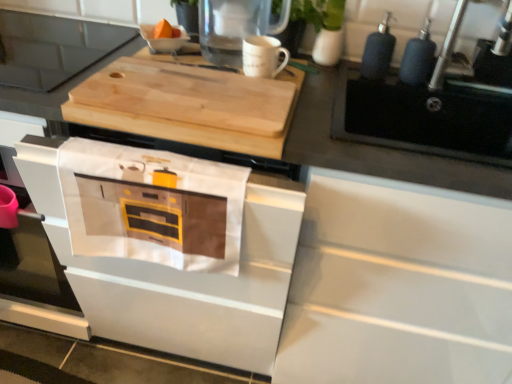
Question: Is clear glass pitcher at upper center placed right next to metallic silver faucet at upper right?

Choices:
 (A) yes
 (B) no

Answer: (B)

Question: Considering the relative sizes of clear glass pitcher at upper center and metallic silver faucet at upper right in the image provided, is clear glass pitcher at upper center smaller than metallic silver faucet at upper right?

Choices:
 (A) no
 (B) yes

Answer: (A)

Question: Considering the relative sizes of clear glass pitcher at upper center and metallic silver faucet at upper right in the image provided, is clear glass pitcher at upper center bigger than metallic silver faucet at upper right?

Choices:
 (A) yes
 (B) no

Answer: (A)

Question: Is clear glass pitcher at upper center wider than metallic silver faucet at upper right?

Choices:
 (A) no
 (B) yes

Answer: (A)

Question: Considering the relative positions of clear glass pitcher at upper center and metallic silver faucet at upper right in the image provided, is clear glass pitcher at upper center behind metallic silver faucet at upper right?

Choices:
 (A) yes
 (B) no

Answer: (A)

Question: Considering the relative sizes of clear glass pitcher at upper center and metallic silver faucet at upper right in the image provided, is clear glass pitcher at upper center thinner than metallic silver faucet at upper right?

Choices:
 (A) no
 (B) yes

Answer: (B)

Question: Is white cotton towel at lower center facing away from natural wood cutting board at upper center?

Choices:
 (A) no
 (B) yes

Answer: (B)

Question: Is white cotton towel at lower center touching natural wood cutting board at upper center?

Choices:
 (A) yes
 (B) no

Answer: (B)

Question: From a real-world perspective, is white cotton towel at lower center positioned under natural wood cutting board at upper center based on gravity?

Choices:
 (A) yes
 (B) no

Answer: (A)

Question: From a real-world perspective, does white cotton towel at lower center stand above natural wood cutting board at upper center?

Choices:
 (A) no
 (B) yes

Answer: (A)

Question: Can you confirm if white cotton towel at lower center is shorter than natural wood cutting board at upper center?

Choices:
 (A) yes
 (B) no

Answer: (B)

Question: Is white cotton towel at lower center not near natural wood cutting board at upper center?

Choices:
 (A) yes
 (B) no

Answer: (B)

Question: Does white cotton towel at lower center have a smaller size compared to metallic silver faucet at upper right?

Choices:
 (A) no
 (B) yes

Answer: (B)